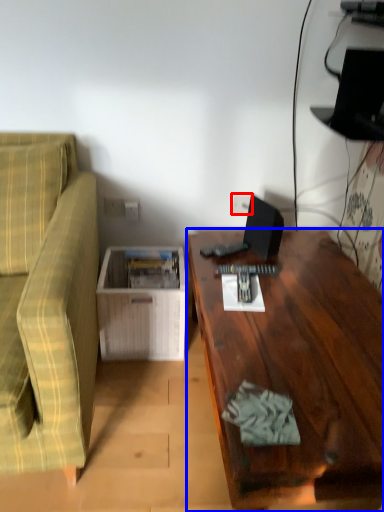
Question: Which of the following is the farthest to the observer, electric outlet (highlighted by a red box) or desk (highlighted by a blue box)?

Choices:
 (A) electric outlet
 (B) desk

Answer: (A)